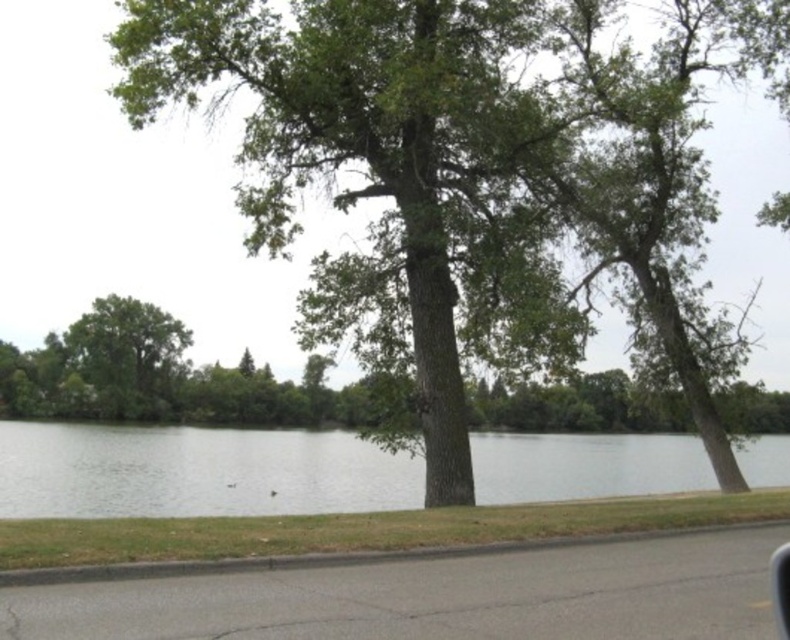
Who is positioned more to the left, clear water at center or transparent glass car window at lower right?

clear water at center is more to the left.

This screenshot has height=640, width=790. Describe the element at coordinates (196, 472) in the screenshot. I see `clear water at center` at that location.

Identify the location of clear water at center. pos(196,472).

Between green leafy tree at center and green leafy tree at left, which one is positioned higher?

green leafy tree at center is above.

Can you confirm if green leafy tree at center is shorter than green leafy tree at left?

No.

Which is behind, point (523, 336) or point (91, 307)?

Positioned behind is point (91, 307).

Find the location of a particular element. The image size is (790, 640). green leafy tree at center is located at coordinates (457, 180).

Does clear water at center have a smaller size compared to green leafy tree at left?

Actually, clear water at center might be larger than green leafy tree at left.

Between clear water at center and green leafy tree at left, which one is positioned higher?

Positioned higher is green leafy tree at left.

Between point (567, 493) and point (111, 308), which one is positioned in front?

Point (567, 493) is in front.

Locate an element on the screen. The width and height of the screenshot is (790, 640). clear water at center is located at coordinates (196, 472).